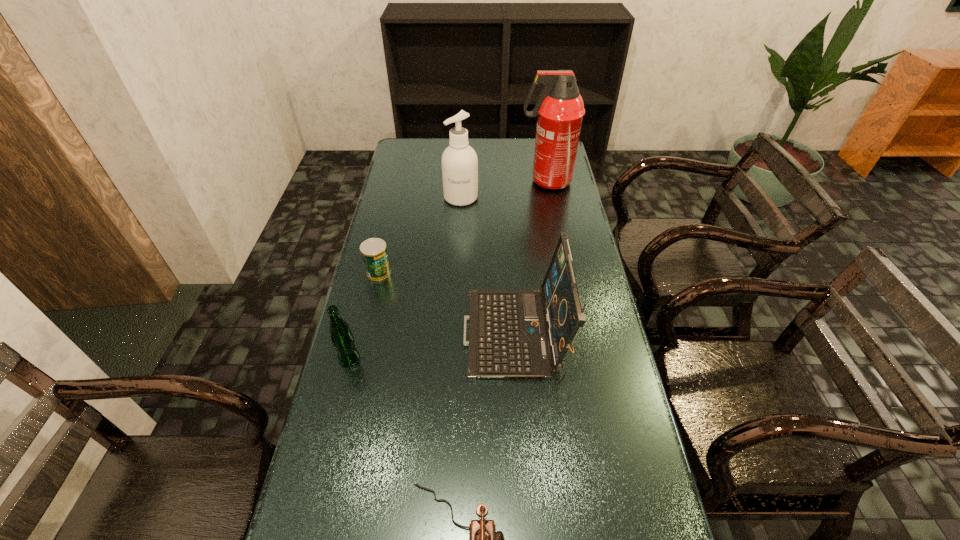
Locate an element on the screen. This screenshot has height=540, width=960. free region that satisfies the following two spatial constraints: 1. on the trigger side of the fire extinguisher; 2. on the front side of the can is located at coordinates (564, 272).

You are a GUI agent. You are given a task and a screenshot of the screen. Output one action in this format:
    pyautogui.click(x=<x>, y=<y>)
    Task: Click on the vacant space that satisfies the following two spatial constraints: 1. on the trigger side of the fire extinguisher; 2. on the front label of the fifth shortest object
    The height and width of the screenshot is (540, 960).
    Given the screenshot: What is the action you would take?
    pyautogui.click(x=549, y=198)

Locate an element on the screen. The image size is (960, 540). vacant space that satisfies the following two spatial constraints: 1. on the trigger side of the tallest object; 2. on the front label of the cleansing agent is located at coordinates (549, 198).

At what (x,y) coordinates should I click in order to perform the action: click on vacant space that satisfies the following two spatial constraints: 1. on the front-facing side of the fourth shortest object; 2. on the front side of the fourth tallest object. Please return your answer as a coordinate pair (x, y). This screenshot has height=540, width=960. Looking at the image, I should click on (516, 359).